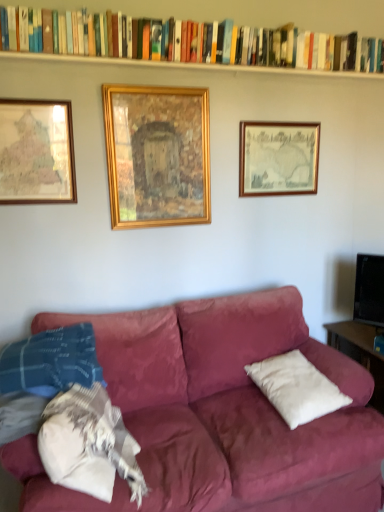
Locate an element on the screen. The width and height of the screenshot is (384, 512). free space above wooden framed map at upper right, the first picture frame in the right-to-left sequence (from a real-world perspective) is located at coordinates (293, 118).